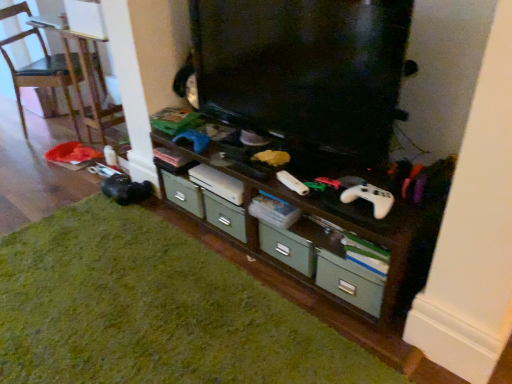
Question: Does wooden chair at left appear on the left side of green matte drawer at lower center?

Choices:
 (A) yes
 (B) no

Answer: (A)

Question: Is wooden chair at left thinner than green matte drawer at lower center?

Choices:
 (A) yes
 (B) no

Answer: (B)

Question: Is wooden chair at left smaller than green matte drawer at lower center?

Choices:
 (A) yes
 (B) no

Answer: (B)

Question: Would you say wooden chair at left is outside green matte drawer at lower center?

Choices:
 (A) yes
 (B) no

Answer: (A)

Question: From the image's perspective, would you say wooden chair at left is positioned over green matte drawer at lower center?

Choices:
 (A) yes
 (B) no

Answer: (A)

Question: In terms of width, does green matte drawer at lower center look wider or thinner when compared to wooden chair at left?

Choices:
 (A) wide
 (B) thin

Answer: (B)

Question: From a real-world perspective, is green matte drawer at lower center physically located above or below wooden chair at left?

Choices:
 (A) below
 (B) above

Answer: (A)

Question: Based on their positions, is green matte drawer at lower center located to the left or right of wooden chair at left?

Choices:
 (A) left
 (B) right

Answer: (B)

Question: In terms of height, does green matte drawer at lower center look taller or shorter compared to wooden chair at left?

Choices:
 (A) tall
 (B) short

Answer: (B)

Question: Is wooden shelf at center taller or shorter than black glossy television at center?

Choices:
 (A) short
 (B) tall

Answer: (A)

Question: Would you say wooden shelf at center is inside or outside black glossy television at center?

Choices:
 (A) outside
 (B) inside

Answer: (A)

Question: Considering the relative positions of wooden shelf at center and black glossy television at center in the image provided, is wooden shelf at center to the left or to the right of black glossy television at center?

Choices:
 (A) left
 (B) right

Answer: (A)

Question: In the image, is wooden shelf at center positioned in front of or behind black glossy television at center?

Choices:
 (A) behind
 (B) front

Answer: (A)

Question: Is point (147, 370) closer or farther from the camera than point (337, 241)?

Choices:
 (A) closer
 (B) farther

Answer: (A)

Question: Is green matte hardwood at lower left in front of or behind wooden shelf at center in the image?

Choices:
 (A) behind
 (B) front

Answer: (B)